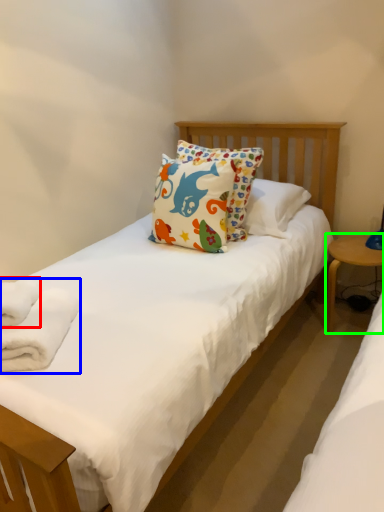
Question: Based on their relative distances, which object is nearer to bath towel (highlighted by a red box)? Choose from bath towel (highlighted by a blue box) and table (highlighted by a green box).

Choices:
 (A) bath towel
 (B) table

Answer: (A)